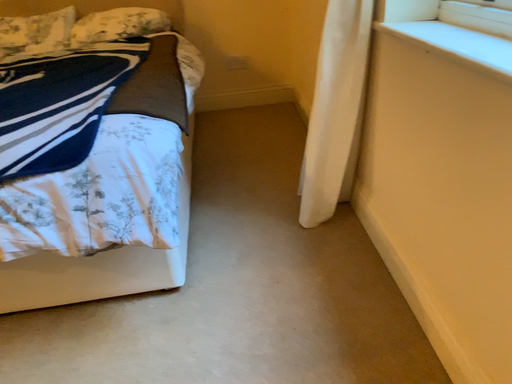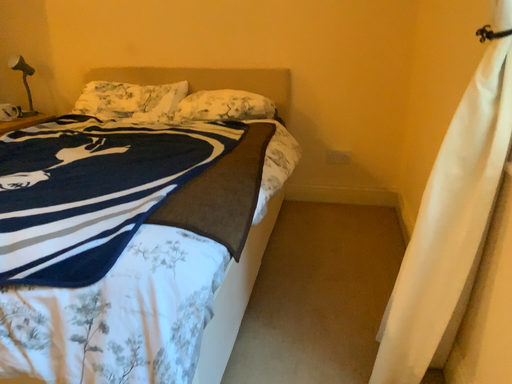
Question: How did the camera likely rotate when shooting the video?

Choices:
 (A) rotated downward
 (B) rotated upward

Answer: (B)